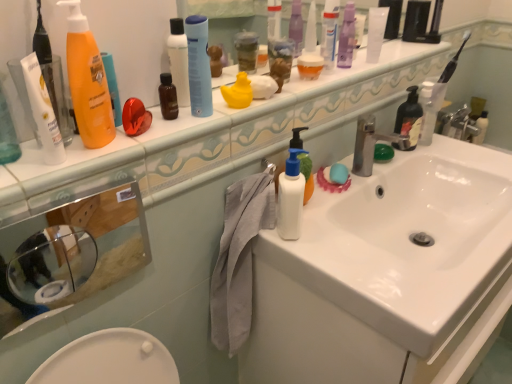
Locate an element on the screen. The height and width of the screenshot is (384, 512). unoccupied region to the right of white matte plastic bottle at center is located at coordinates (352, 248).